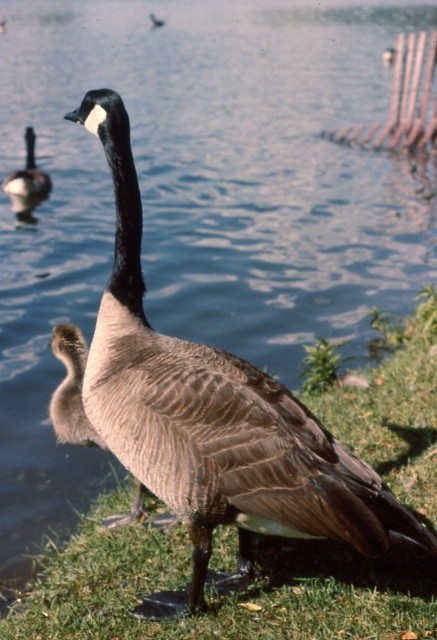
Question: Among these objects, which one is farthest from the camera?

Choices:
 (A) brown feathered duckling at upper left
 (B) brown matte duck at center

Answer: (A)

Question: Can you confirm if brown feathered goose at center is positioned below brown feathered duckling at upper left?

Choices:
 (A) no
 (B) yes

Answer: (B)

Question: Can you confirm if brown matte duck at center is positioned below brown feathered duckling at upper left?

Choices:
 (A) no
 (B) yes

Answer: (B)

Question: Among these objects, which one is farthest from the camera?

Choices:
 (A) brown feathered duckling at upper left
 (B) brown feathered goose at center
 (C) brown matte duck at center

Answer: (A)

Question: Among these objects, which one is nearest to the camera?

Choices:
 (A) brown matte duck at center
 (B) brown feathered goose at center

Answer: (A)

Question: Does brown matte duck at center have a larger size compared to brown feathered goose at center?

Choices:
 (A) yes
 (B) no

Answer: (A)